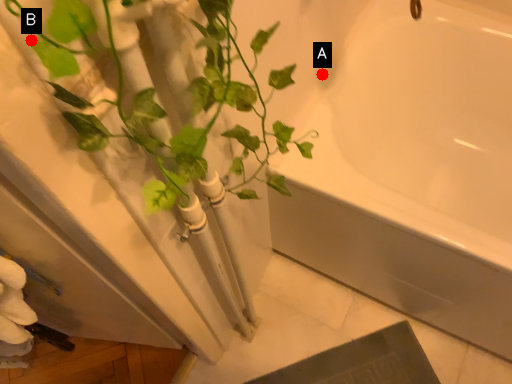
Question: Two points are circled on the image, labeled by A and B beside each circle. Which of the following is the farthest from the observer?

Choices:
 (A) A is further
 (B) B is further

Answer: (A)